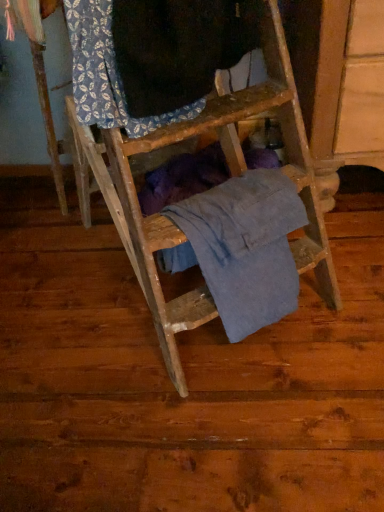
What do you see at coordinates (242, 247) in the screenshot?
I see `blue cotton shirt at center, the second clothing when ordered from top to bottom` at bounding box center [242, 247].

Measure the distance between blue cotton shirt at center, the second clothing when ordered from top to bottom, and camera.

The depth of blue cotton shirt at center, the second clothing when ordered from top to bottom, is 34.99 inches.

This screenshot has width=384, height=512. Identify the location of blue cotton shirt at center, the 1th clothing from the bottom. (242, 247).

Find the location of a particular element. blue printed fabric at upper left, which is the 1th clothing from top to bottom is located at coordinates (153, 57).

The height and width of the screenshot is (512, 384). What do you see at coordinates (153, 57) in the screenshot?
I see `blue printed fabric at upper left, placed as the 2th clothing when sorted from bottom to top` at bounding box center [153, 57].

Image resolution: width=384 pixels, height=512 pixels. Identify the location of blue cotton shirt at center, the second clothing when ordered from top to bottom. (242, 247).

Can you confirm if blue cotton shirt at center, the second clothing when ordered from top to bottom, is positioned to the right of blue printed fabric at upper left, which is the 1th clothing from top to bottom?

Yes.

Which object is further away from the camera taking this photo, blue cotton shirt at center, the 1th clothing from the bottom, or blue printed fabric at upper left, which is the 1th clothing from top to bottom?

blue cotton shirt at center, the 1th clothing from the bottom, is behind.

Looking at this image, which is closer to the camera, [220,265] or [134,95]?

Point [134,95]

From the image's perspective, which one is positioned higher, blue cotton shirt at center, the 1th clothing from the bottom, or blue printed fabric at upper left, placed as the 2th clothing when sorted from bottom to top?

blue printed fabric at upper left, placed as the 2th clothing when sorted from bottom to top, is shown above in the image.

From a real-world perspective, who is located higher, blue cotton shirt at center, the 1th clothing from the bottom, or blue printed fabric at upper left, placed as the 2th clothing when sorted from bottom to top?

blue printed fabric at upper left, placed as the 2th clothing when sorted from bottom to top.

Between blue cotton shirt at center, the 1th clothing from the bottom, and blue printed fabric at upper left, which is the 1th clothing from top to bottom, which one has smaller width?

With smaller width is blue cotton shirt at center, the 1th clothing from the bottom.

From their relative heights in the image, would you say blue cotton shirt at center, the 1th clothing from the bottom, is taller or shorter than blue printed fabric at upper left, which is the 1th clothing from top to bottom?

Considering their sizes, blue cotton shirt at center, the 1th clothing from the bottom, has more height than blue printed fabric at upper left, which is the 1th clothing from top to bottom.

Consider the image. Between blue cotton shirt at center, the 1th clothing from the bottom, and blue printed fabric at upper left, which is the 1th clothing from top to bottom, which one has larger size?

Bigger between the two is blue printed fabric at upper left, which is the 1th clothing from top to bottom.

Is blue cotton shirt at center, the second clothing when ordered from top to bottom, positioned beyond the bounds of blue printed fabric at upper left, placed as the 2th clothing when sorted from bottom to top?

Yes.

Is the surface of blue cotton shirt at center, the 1th clothing from the bottom, in direct contact with blue printed fabric at upper left, which is the 1th clothing from top to bottom?

No, blue cotton shirt at center, the 1th clothing from the bottom, is not making contact with blue printed fabric at upper left, which is the 1th clothing from top to bottom.

Could you tell me if blue cotton shirt at center, the 1th clothing from the bottom, is facing blue printed fabric at upper left, which is the 1th clothing from top to bottom?

No, blue cotton shirt at center, the 1th clothing from the bottom, is not oriented towards blue printed fabric at upper left, which is the 1th clothing from top to bottom.

How different are the orientations of blue cotton shirt at center, the 1th clothing from the bottom, and blue printed fabric at upper left, which is the 1th clothing from top to bottom, in degrees?

They differ by 5.55e-05 degrees in their facing directions.

What are the coordinates of `clothing directly beneath the blue printed fabric at upper left, placed as the 2th clothing when sorted from bottom to top (from a real-world perspective)` in the screenshot? It's located at (242, 247).

Which object is positioned more to the left, blue printed fabric at upper left, placed as the 2th clothing when sorted from bottom to top, or blue cotton shirt at center, the 1th clothing from the bottom?

From the viewer's perspective, blue printed fabric at upper left, placed as the 2th clothing when sorted from bottom to top, appears more on the left side.

Is the position of blue printed fabric at upper left, placed as the 2th clothing when sorted from bottom to top, more distant than that of blue cotton shirt at center, the second clothing when ordered from top to bottom?

No, blue printed fabric at upper left, placed as the 2th clothing when sorted from bottom to top, is closer to the viewer.

Between point (133, 47) and point (281, 287), which one is positioned behind?

Positioned behind is point (281, 287).

From the image's perspective, is blue printed fabric at upper left, which is the 1th clothing from top to bottom, located beneath blue cotton shirt at center, the second clothing when ordered from top to bottom?

No.

From a real-world perspective, is blue printed fabric at upper left, which is the 1th clothing from top to bottom, physically below blue cotton shirt at center, the 1th clothing from the bottom?

No, from a real-world perspective, blue printed fabric at upper left, which is the 1th clothing from top to bottom, is not beneath blue cotton shirt at center, the 1th clothing from the bottom.

Looking at their sizes, would you say blue printed fabric at upper left, placed as the 2th clothing when sorted from bottom to top, is wider or thinner than blue cotton shirt at center, the 1th clothing from the bottom?

Considering their sizes, blue printed fabric at upper left, placed as the 2th clothing when sorted from bottom to top, looks broader than blue cotton shirt at center, the 1th clothing from the bottom.

Which of these two, blue printed fabric at upper left, which is the 1th clothing from top to bottom, or blue cotton shirt at center, the second clothing when ordered from top to bottom, stands taller?

blue cotton shirt at center, the second clothing when ordered from top to bottom.

Is blue printed fabric at upper left, placed as the 2th clothing when sorted from bottom to top, smaller than blue cotton shirt at center, the second clothing when ordered from top to bottom?

No, blue printed fabric at upper left, placed as the 2th clothing when sorted from bottom to top, is not smaller than blue cotton shirt at center, the second clothing when ordered from top to bottom.

Would you say blue printed fabric at upper left, which is the 1th clothing from top to bottom, is outside blue cotton shirt at center, the second clothing when ordered from top to bottom?

Yes.

Is blue printed fabric at upper left, placed as the 2th clothing when sorted from bottom to top, positioned far away from blue cotton shirt at center, the second clothing when ordered from top to bottom?

No, blue printed fabric at upper left, placed as the 2th clothing when sorted from bottom to top, is not far from blue cotton shirt at center, the second clothing when ordered from top to bottom.

Is blue printed fabric at upper left, which is the 1th clothing from top to bottom, turned away from blue cotton shirt at center, the 1th clothing from the bottom?

blue printed fabric at upper left, which is the 1th clothing from top to bottom, is not turned away from blue cotton shirt at center, the 1th clothing from the bottom.

Identify the location of clothing that appears behind the blue printed fabric at upper left, which is the 1th clothing from top to bottom. The width and height of the screenshot is (384, 512). pyautogui.click(x=242, y=247).

You are a GUI agent. You are given a task and a screenshot of the screen. Output one action in this format:
    pyautogui.click(x=<x>, y=<y>)
    Task: Click on the clothing to the right of blue printed fabric at upper left, which is the 1th clothing from top to bottom
    The width and height of the screenshot is (384, 512).
    Given the screenshot: What is the action you would take?
    pyautogui.click(x=242, y=247)

At what (x,y) coordinates should I click in order to perform the action: click on clothing on the left of blue cotton shirt at center, the second clothing when ordered from top to bottom. Please return your answer as a coordinate pair (x, y). The height and width of the screenshot is (512, 384). Looking at the image, I should click on (153, 57).